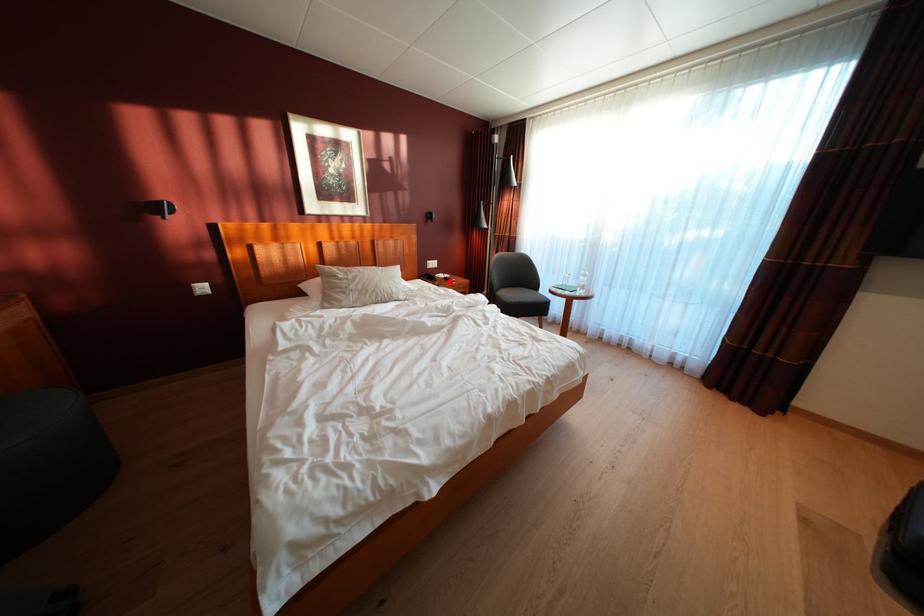
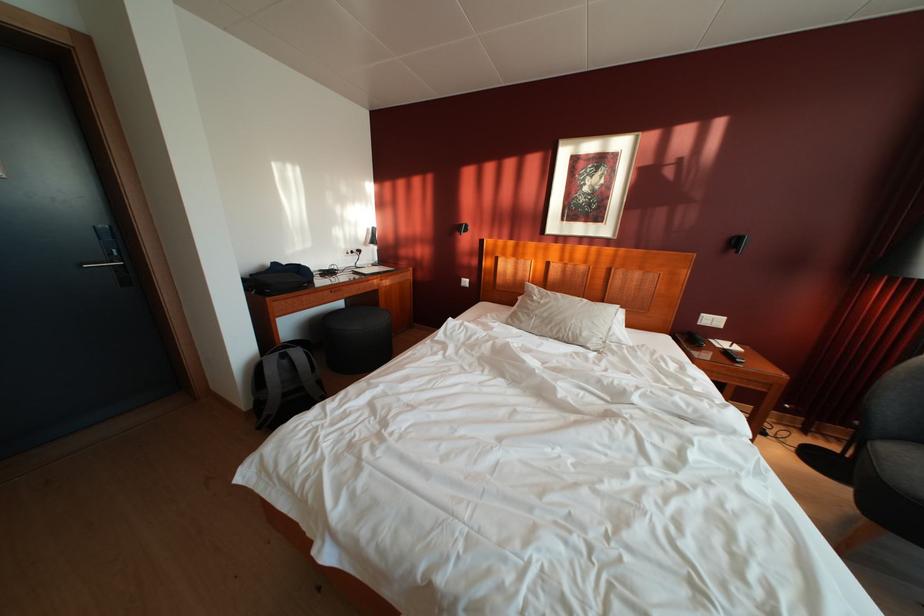
In the second image, find the point that corresponds to the highlighted location in the first image.

(732, 350)